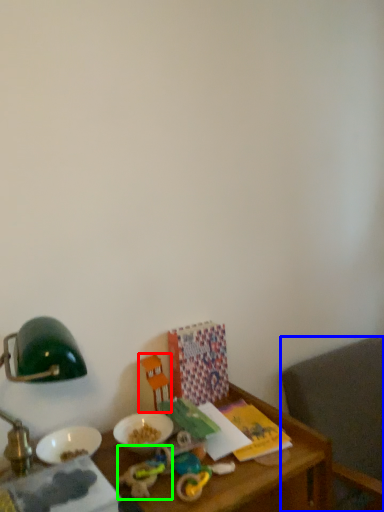
Question: Based on their relative distances, which object is nearer to toy (highlighted by a red box)? Choose from chair (highlighted by a blue box) and toy (highlighted by a green box).

Choices:
 (A) chair
 (B) toy

Answer: (B)